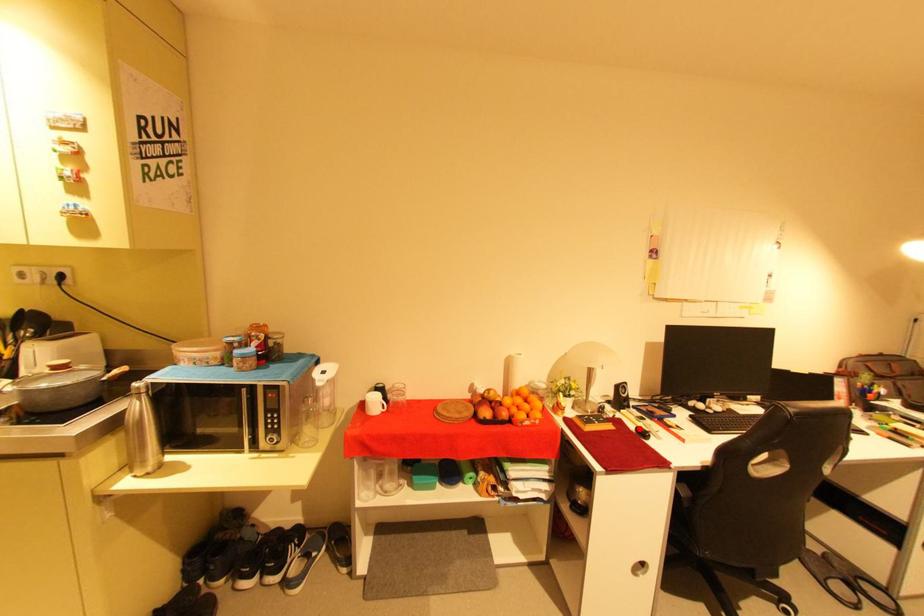
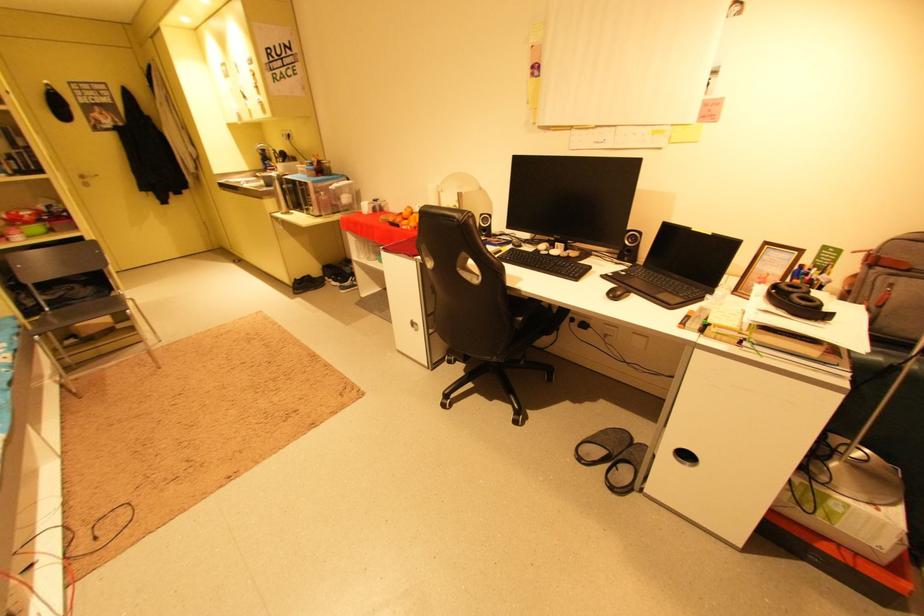
Question: I am providing you with two images of the same scene from different viewpoints. A red point is marked on the first image. Is the red point's position out of view in image 2?

Choices:
 (A) Yes
 (B) No

Answer: (A)